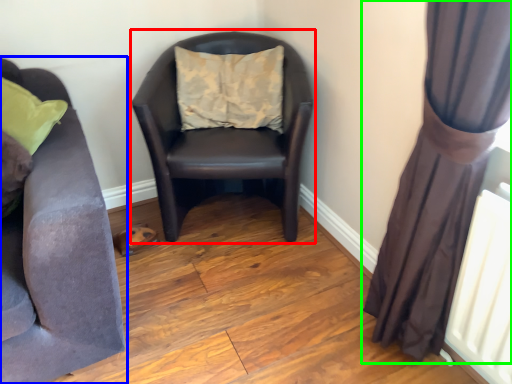
Question: Considering the real-world distances, which object is closest to rocking chair (highlighted by a red box)? studio couch (highlighted by a blue box) or curtain (highlighted by a green box).

Choices:
 (A) studio couch
 (B) curtain

Answer: (A)